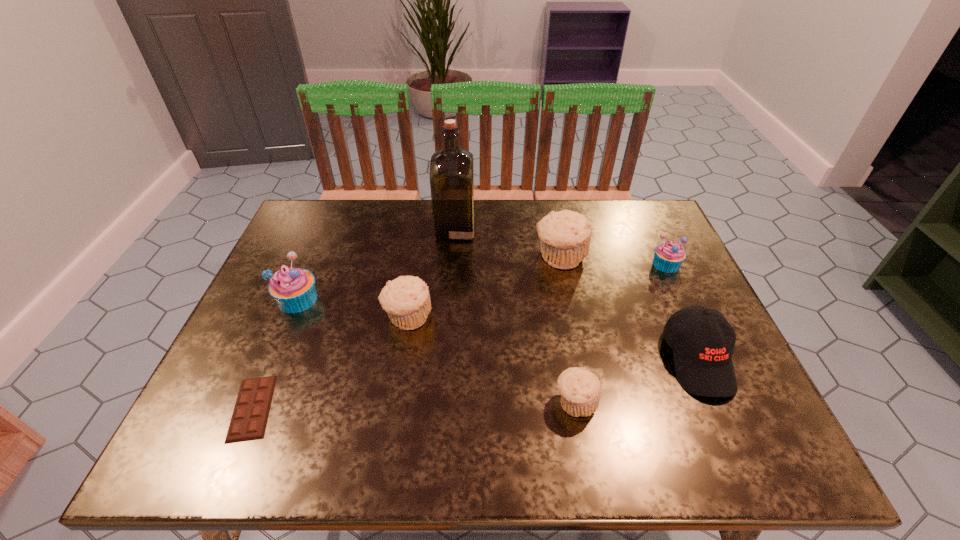
Where is `vacant space at the far edge of the desktop`? This screenshot has width=960, height=540. vacant space at the far edge of the desktop is located at coordinates (362, 221).

In the image, there is a desktop. Where is `vacant space at the near edge`? vacant space at the near edge is located at coordinates (438, 443).

Where is `free space at the left edge`? The height and width of the screenshot is (540, 960). free space at the left edge is located at coordinates pyautogui.click(x=319, y=247).

Image resolution: width=960 pixels, height=540 pixels. In the image, there is a desktop. What are the coordinates of `vacant space at the right edge` in the screenshot? It's located at (736, 369).

Locate an element on the screen. The image size is (960, 540). vacant space at the far left corner of the desktop is located at coordinates (339, 206).

Find the location of a particular element. The height and width of the screenshot is (540, 960). vacant space at the near right corner of the desktop is located at coordinates (725, 427).

Where is `free space between the liquor and the leftmost beige muffin`? This screenshot has width=960, height=540. free space between the liquor and the leftmost beige muffin is located at coordinates (431, 273).

The height and width of the screenshot is (540, 960). I want to click on vacant space in between the biggest beige muffin and the tallest object, so click(508, 242).

In order to click on unoccupied area between the nearest muffin and the black baseball cap in this screenshot , I will do `click(636, 381)`.

You are a GUI agent. You are given a task and a screenshot of the screen. Output one action in this format:
    pyautogui.click(x=<x>, y=<y>)
    Task: Click on the free spot between the nearest beige muffin and the rightmost muffin
    
    Given the screenshot: What is the action you would take?
    pyautogui.click(x=621, y=333)